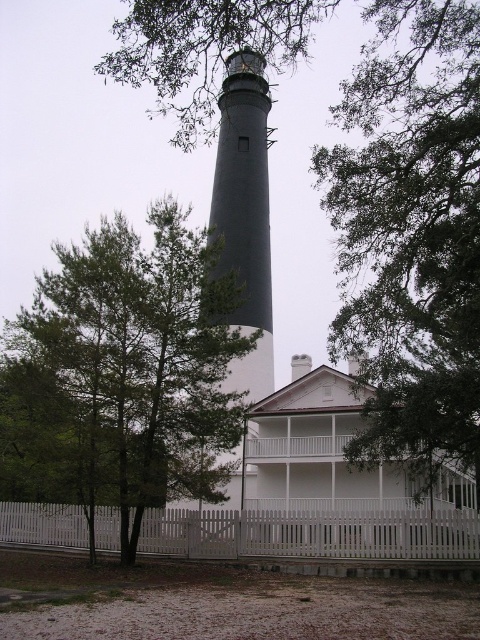
Question: From the image, what is the correct spatial relationship of green leafy tree at center in relation to white picket fence at lower center?

Choices:
 (A) below
 (B) above

Answer: (B)

Question: Is green leafy tree at center thinner than dark gray concrete lighthouse at center?

Choices:
 (A) yes
 (B) no

Answer: (B)

Question: Which of the following is the farthest from the observer?

Choices:
 (A) (x=202, y=464)
 (B) (x=10, y=524)
 (C) (x=265, y=138)

Answer: (C)

Question: Is green leafy tree at center thinner than dark gray concrete lighthouse at center?

Choices:
 (A) no
 (B) yes

Answer: (A)

Question: Which object is farther from the camera taking this photo?

Choices:
 (A) green leafy tree at center
 (B) dark gray concrete lighthouse at center
 (C) white picket fence at lower center

Answer: (B)

Question: Which of these objects is positioned closest to the dark gray concrete lighthouse at center?

Choices:
 (A) green leafy tree at left
 (B) green leafy tree at center

Answer: (A)